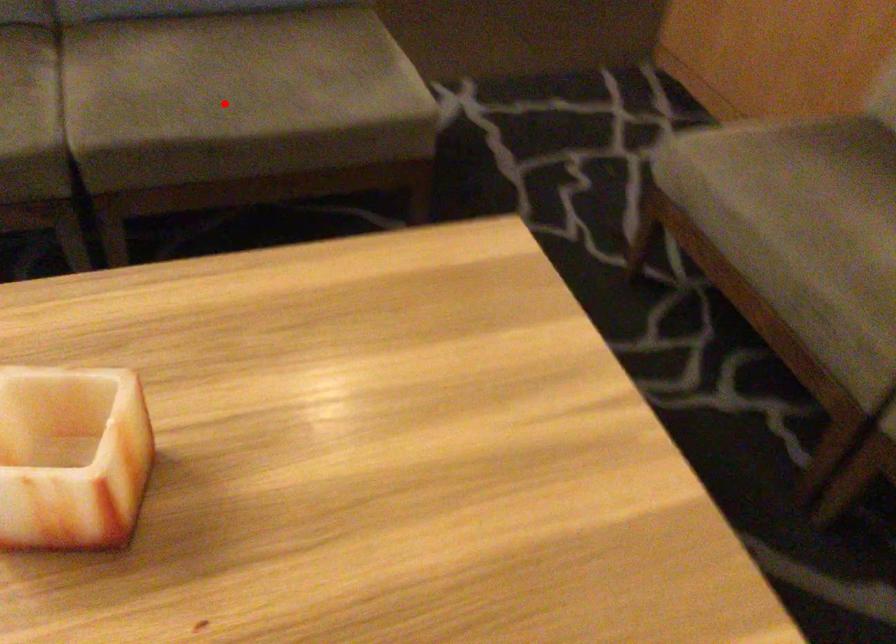
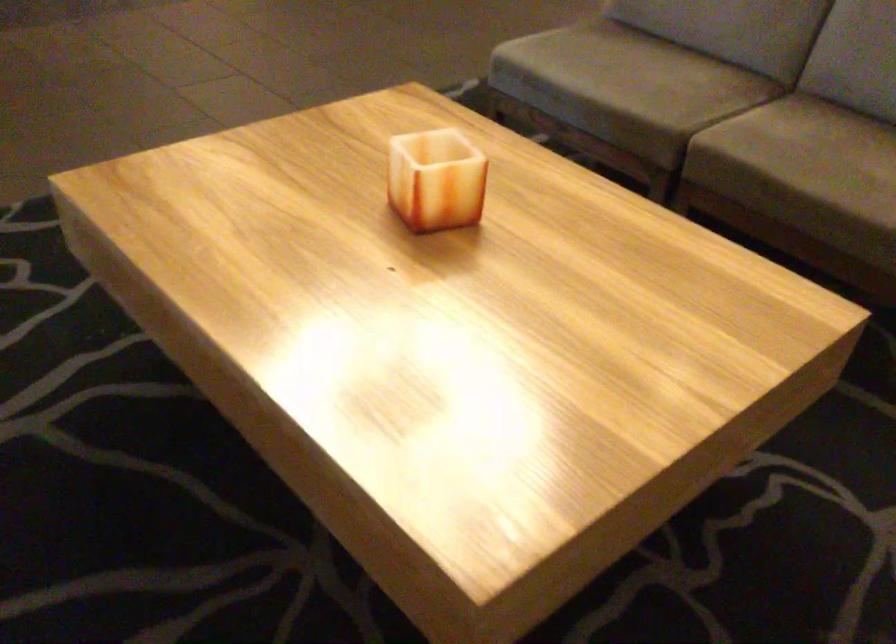
Question: A red point is marked in image1. In image2, is the corresponding 3D point closer to the camera or farther? Reply with the corresponding letter.

Choices:
 (A) The corresponding 3D point is closer.
 (B) The corresponding 3D point is farther.

Answer: (B)